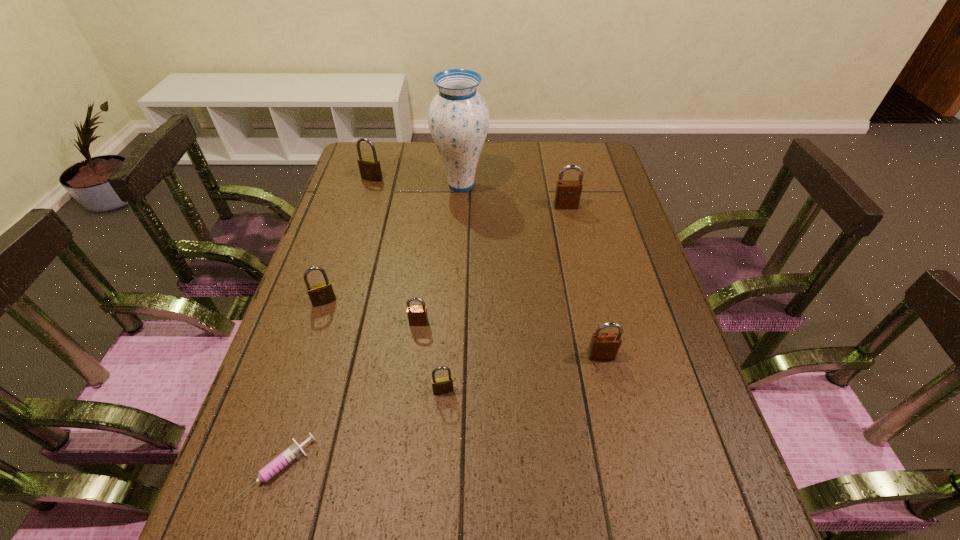
Locate an element on the screen. The width and height of the screenshot is (960, 540). the smallest brass padlock is located at coordinates (442, 385).

Identify the location of the seventh farthest object. The height and width of the screenshot is (540, 960). (442, 385).

Where is `the fifth farthest object`? the fifth farthest object is located at coordinates (417, 315).

The image size is (960, 540). Find the location of `the leftmost brown padlock`. the leftmost brown padlock is located at coordinates (417, 315).

The image size is (960, 540). I want to click on the nearest object, so click(x=292, y=452).

Image resolution: width=960 pixels, height=540 pixels. Find the location of `syringe`. syringe is located at coordinates coord(292,452).

In order to click on vacant position located on the right of the blue vase in this screenshot , I will do `click(554, 185)`.

You are a GUI agent. You are given a task and a screenshot of the screen. Output one action in this format:
    pyautogui.click(x=<x>, y=<y>)
    Task: Click on the blank space located 0.350m on the front of the biggest brass padlock
    
    Given the screenshot: What is the action you would take?
    pyautogui.click(x=349, y=252)

Locate an element on the screen. This screenshot has width=960, height=540. vacant area situated on the front-facing side of the biggest brown padlock is located at coordinates (572, 234).

This screenshot has width=960, height=540. I want to click on free point located on the right of the third farthest padlock, so click(478, 301).